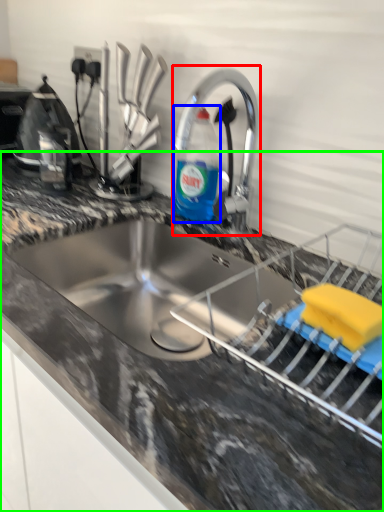
Question: Considering the real-world distances, which object is closest to tap (highlighted by a red box)? bottle (highlighted by a blue box) or countertop (highlighted by a green box).

Choices:
 (A) bottle
 (B) countertop

Answer: (A)